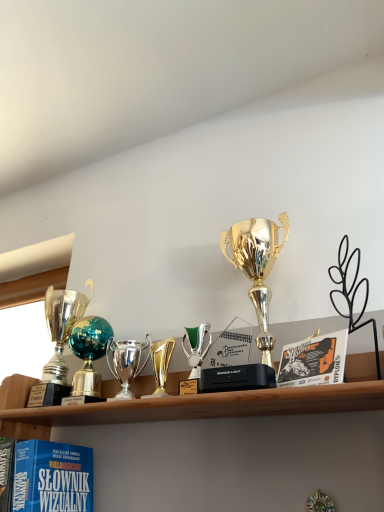
Question: Is point (110, 364) positioned closer to the camera than point (18, 479)?

Choices:
 (A) farther
 (B) closer

Answer: (A)

Question: From a real-world perspective, is polished silver trophy at center, acting as the 3th trophy starting from the right, above or below matte blue book at lower left?

Choices:
 (A) above
 (B) below

Answer: (A)

Question: Which object is the closest to the polished silver trophy at center, placed as the second trophy when sorted from left to right?

Choices:
 (A) shiny silver trophy at left, the 1th trophy positioned from the left
 (B) matte blue book at lower left
 (C) gold shiny trophy at center, the third trophy when ordered from left to right
 (D) gold shiny trophy at center, marked as the 4th trophy in a left-to-right arrangement
 (E) metallic trophy at left

Answer: (A)

Question: Which object is the farthest from the polished silver trophy at center, acting as the 3th trophy starting from the right?

Choices:
 (A) matte blue book at lower left
 (B) gold shiny trophy at center, the third trophy when ordered from left to right
 (C) gold shiny trophy at center, which is counted as the 1th trophy, starting from the right
 (D) shiny silver trophy at left, the 4th trophy from the right
 (E) metallic trophy at left

Answer: (E)